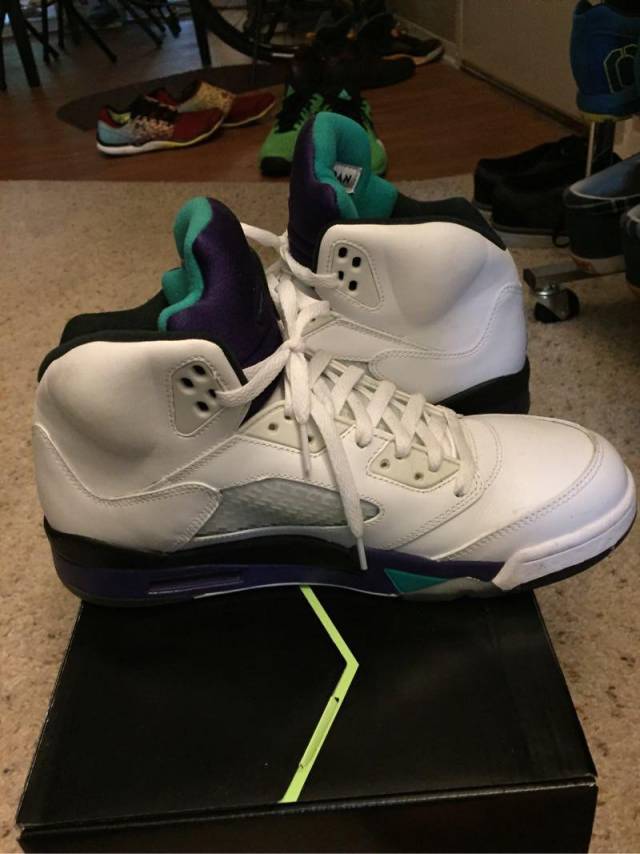
Where is `wall`? wall is located at coordinates (502, 34).